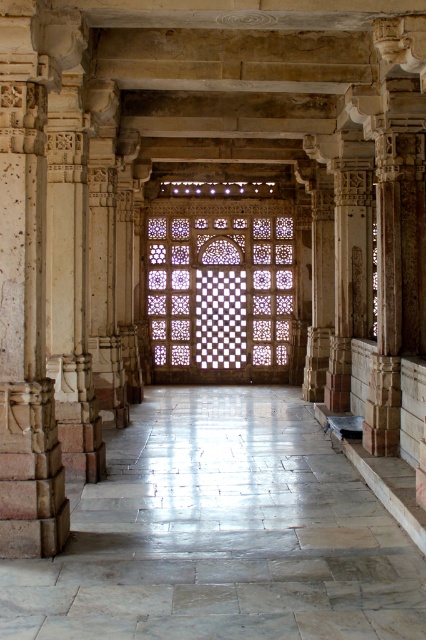
From the picture: You are an architect designing a new building and want to incorporate elements from this historical site. If you plan to use both the white marble corridor at center and the translucent stone lattice at center in your design, which one should you place in a narrower space to maintain structural integrity?

The translucent stone lattice at center should be placed in a narrower space because its width is smaller than the white marble corridor at center, ensuring it fits appropriately without compromising structural integrity.

You are an architect designing a new building and want to incorporate elements from this historical site. You have two key features to consider from the image provided. Which of the two objects, the white marble corridor at center or the translucent stone lattice at center, has a greater height in the scene?

The translucent stone lattice at center is taller than the white marble corridor at center.

You are standing in the corridor of the historical building and want to walk towards the ornate door at the end. There is a point marked at coordinates (221, 532) in the image. Is this point located on the white marble corridor at center?

Yes, the point (221, 532) is on the white marble corridor at center, so it is located on the corridor.